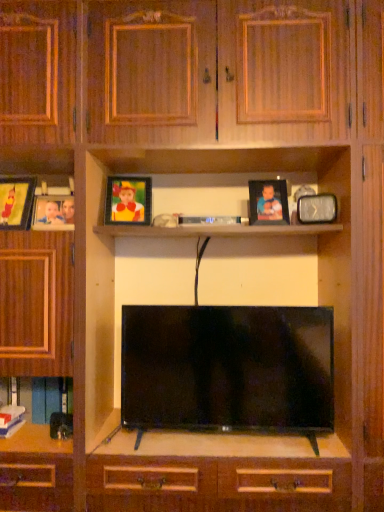
Question: Is matte wooden picture frame at left, arranged as the first picture frame when viewed from the left, a part of matte plastic picture frame at left, the second picture frame viewed from the left?

Choices:
 (A) yes
 (B) no

Answer: (B)

Question: From the image's perspective, is matte plastic picture frame at left, the fourth picture frame when ordered from right to left, on matte wooden picture frame at left, arranged as the first picture frame when viewed from the left?

Choices:
 (A) no
 (B) yes

Answer: (A)

Question: Is matte plastic picture frame at left, the second picture frame viewed from the left, to the left of matte wooden picture frame at left, the fifth picture frame in the right-to-left sequence, from the viewer's perspective?

Choices:
 (A) no
 (B) yes

Answer: (A)

Question: Can you confirm if matte plastic picture frame at left, the fourth picture frame when ordered from right to left, is wider than matte wooden picture frame at left, arranged as the first picture frame when viewed from the left?

Choices:
 (A) yes
 (B) no

Answer: (B)

Question: Does matte plastic picture frame at left, the fourth picture frame when ordered from right to left, have a smaller size compared to matte wooden picture frame at left, arranged as the first picture frame when viewed from the left?

Choices:
 (A) yes
 (B) no

Answer: (A)

Question: Does matte plastic picture frame at left, the second picture frame viewed from the left, turn towards matte wooden picture frame at left, the fifth picture frame in the right-to-left sequence?

Choices:
 (A) yes
 (B) no

Answer: (B)

Question: Could you tell me if hardcover book at lower left, positioned as the 2th book in front-to-back order, is turned towards matte plastic picture frame at left, the fourth picture frame when ordered from right to left?

Choices:
 (A) no
 (B) yes

Answer: (A)

Question: Can matte plastic picture frame at left, the fourth picture frame when ordered from right to left, be found inside hardcover book at lower left, positioned as the 2th book in front-to-back order?

Choices:
 (A) no
 (B) yes

Answer: (A)

Question: Is hardcover book at lower left, the 1th book when ordered from back to front, taller than matte plastic picture frame at left, the fourth picture frame when ordered from right to left?

Choices:
 (A) yes
 (B) no

Answer: (A)

Question: Is hardcover book at lower left, the 1th book when ordered from back to front, next to matte plastic picture frame at left, the fourth picture frame when ordered from right to left?

Choices:
 (A) yes
 (B) no

Answer: (B)

Question: Is hardcover book at lower left, positioned as the 2th book in front-to-back order, thinner than matte plastic picture frame at left, the fourth picture frame when ordered from right to left?

Choices:
 (A) no
 (B) yes

Answer: (A)

Question: Is hardcover book at lower left, the 1th book when ordered from back to front, in front of matte plastic picture frame at left, the fourth picture frame when ordered from right to left?

Choices:
 (A) yes
 (B) no

Answer: (B)

Question: Can you confirm if black glossy flat-screen tv at center is taller than matte plastic picture frame at upper center, which appears as the third picture frame when viewed from the left?

Choices:
 (A) yes
 (B) no

Answer: (A)